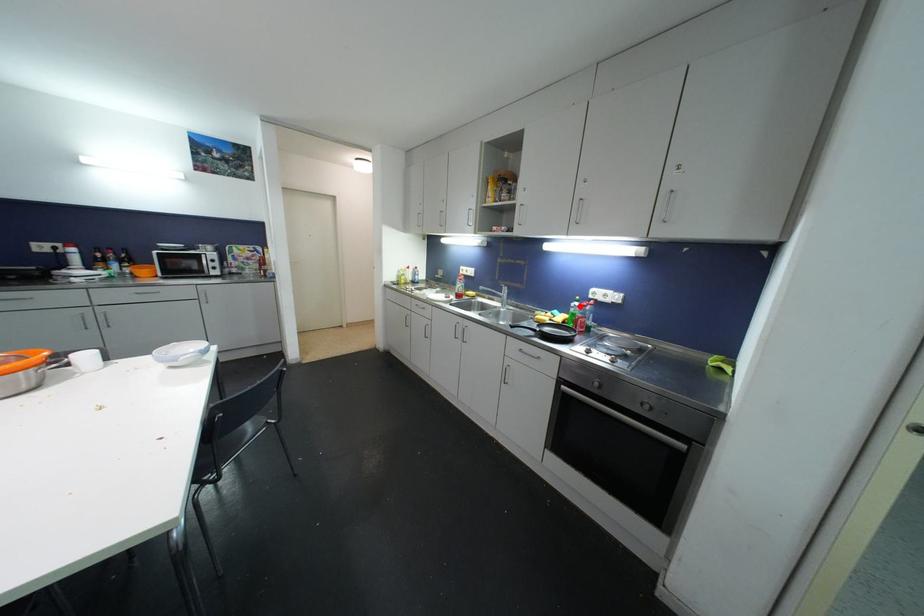
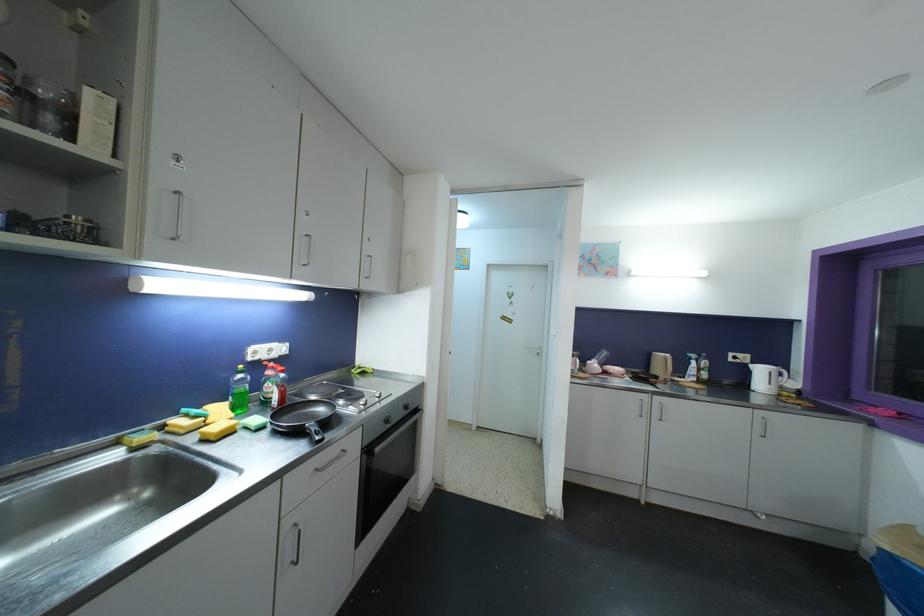
Question: I am providing you with two images of the same scene from different viewpoints. A red point is marked on the first image. Can you still see the location of the red point in image 2?

Choices:
 (A) Yes
 (B) No

Answer: (A)